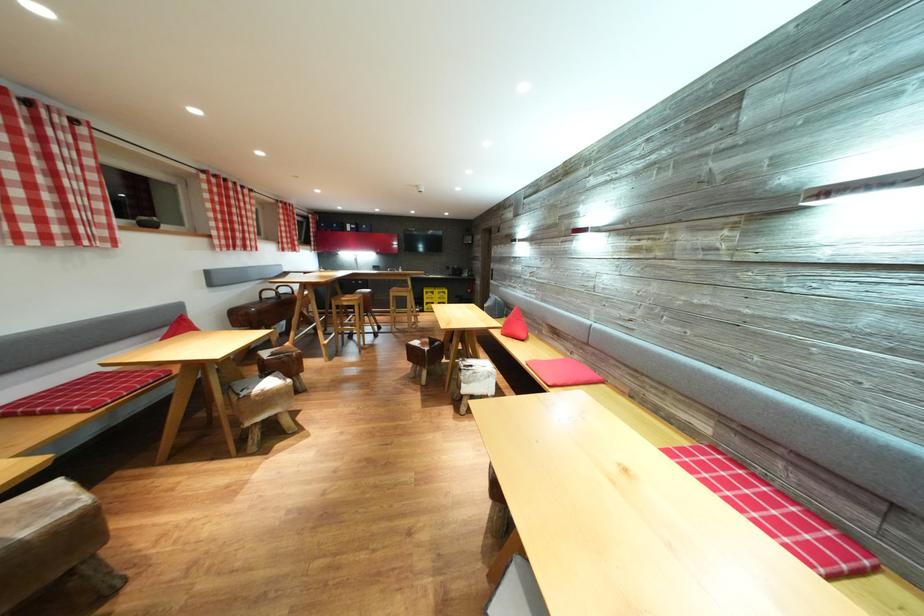
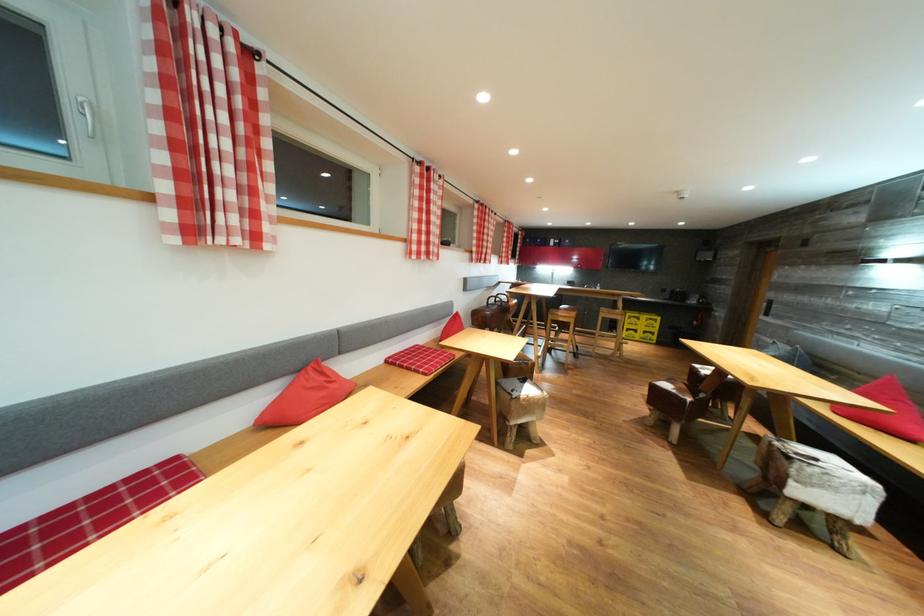
Question: I am providing you with two images of the same scene from different viewpoints. After the viewpoint changes to image2, which objects are now occluded?

Choices:
 (A) chair sitting surface
 (B) brown leather handle
 (C) red pillow
 (D) none of these

Answer: (D)